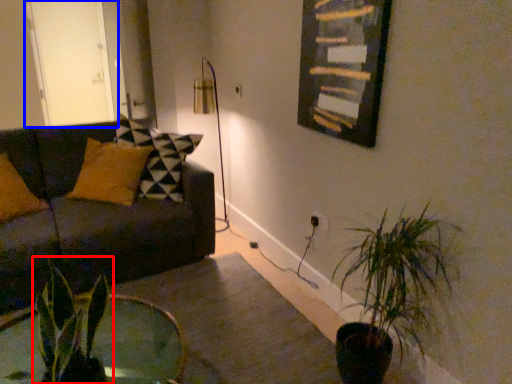
Question: Which object is closer to the camera taking this photo, houseplant (highlighted by a red box) or glass door (highlighted by a blue box)?

Choices:
 (A) houseplant
 (B) glass door

Answer: (A)